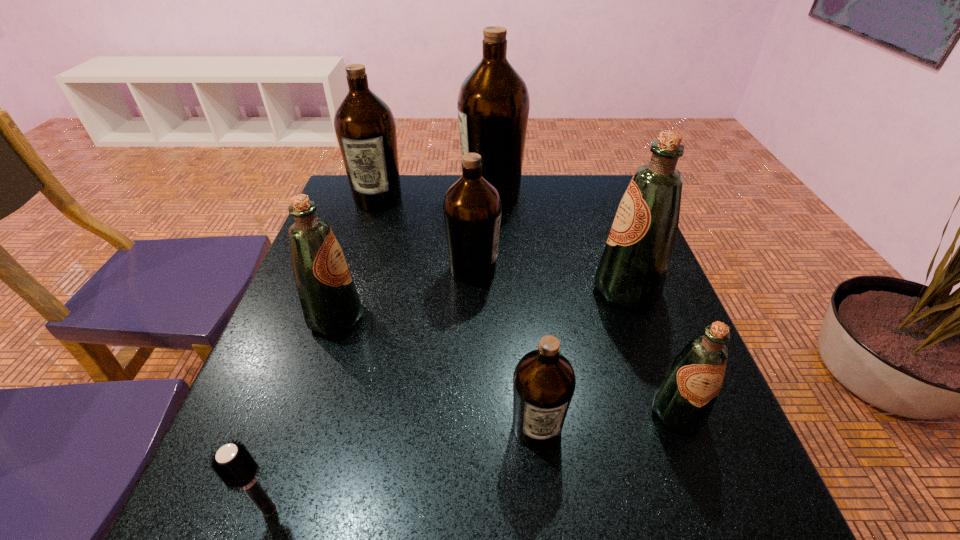
Where is `vacant space located on the label of the tallest object`? vacant space located on the label of the tallest object is located at coordinates (368, 193).

Where is `free space located on the label of the tallest object`? free space located on the label of the tallest object is located at coordinates (395, 193).

Locate an element on the screen. This screenshot has width=960, height=540. vacant position located 0.300m on the label of the tallest object is located at coordinates (361, 193).

What are the coordinates of `free space located 0.260m on the label of the second biggest brown olive oil` in the screenshot? It's located at (354, 274).

Where is `free space located on the front-facing side of the biggest green olive oil`? free space located on the front-facing side of the biggest green olive oil is located at coordinates (468, 289).

In order to click on vacant space located 0.340m on the front-facing side of the biggest green olive oil in this screenshot , I will do `click(446, 289)`.

Identify the location of free location located on the front-facing side of the biggest green olive oil. (433, 289).

The width and height of the screenshot is (960, 540). What are the coordinates of `vacant area situated on the front-facing side of the second biggest green olive oil` in the screenshot? It's located at (415, 318).

Identify the location of vacant area situated on the label of the third biggest brown olive oil. The width and height of the screenshot is (960, 540). (660, 270).

Locate an element on the screen. The image size is (960, 540). vacant region located 0.060m on the label of the smallest brown olive oil is located at coordinates (543, 490).